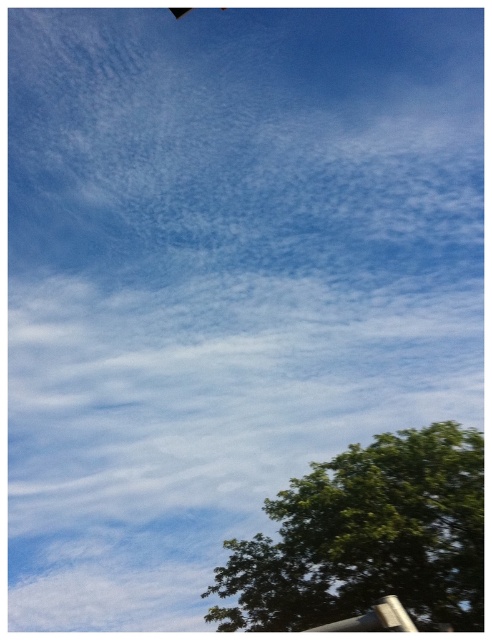
Question: Can you confirm if green leafy tree at lower right is positioned to the left of brushed metal pole at lower right?

Choices:
 (A) no
 (B) yes

Answer: (A)

Question: Does green leafy tree at lower right appear under brushed metal pole at lower right?

Choices:
 (A) yes
 (B) no

Answer: (A)

Question: Is green leafy tree at lower right bigger than brushed metal pole at lower right?

Choices:
 (A) no
 (B) yes

Answer: (A)

Question: Among these objects, which one is farthest from the camera?

Choices:
 (A) brushed metal pole at lower right
 (B) green leafy tree at lower right

Answer: (B)